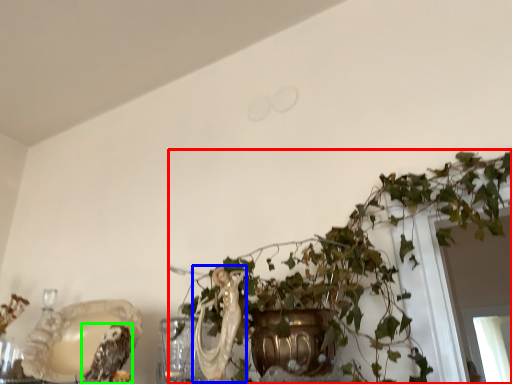
Question: Considering the real-world distances, which object is closest to houseplant (highlighted by a red box)? animal (highlighted by a blue box) or owl (highlighted by a green box).

Choices:
 (A) animal
 (B) owl

Answer: (A)